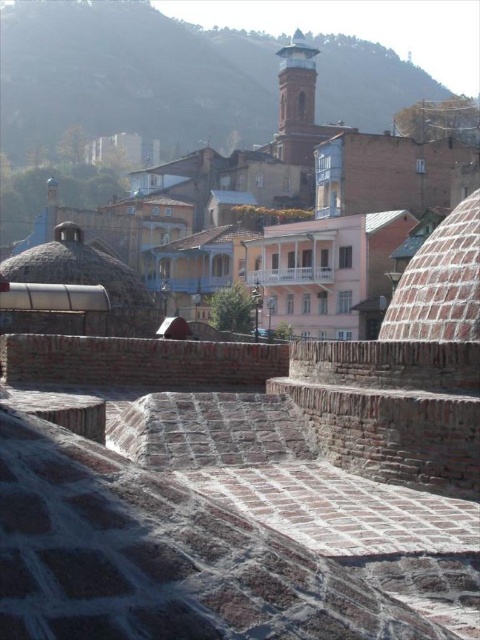
Who is taller, brown brick town at center or smooth brick tower at upper center?

Standing taller between the two is brown brick town at center.

What do you see at coordinates (303, 179) in the screenshot? I see `brown brick town at center` at bounding box center [303, 179].

Measure the distance between brown brick town at center and camera.

A distance of 90.55 meters exists between brown brick town at center and camera.

Locate an element on the screen. brown brick town at center is located at coordinates (303, 179).